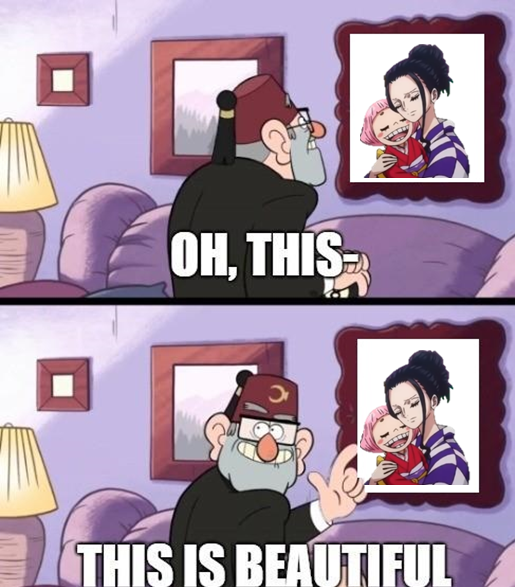
This screenshot has height=587, width=515. Identify the location of grey lamp. (15, 538), (28, 251).